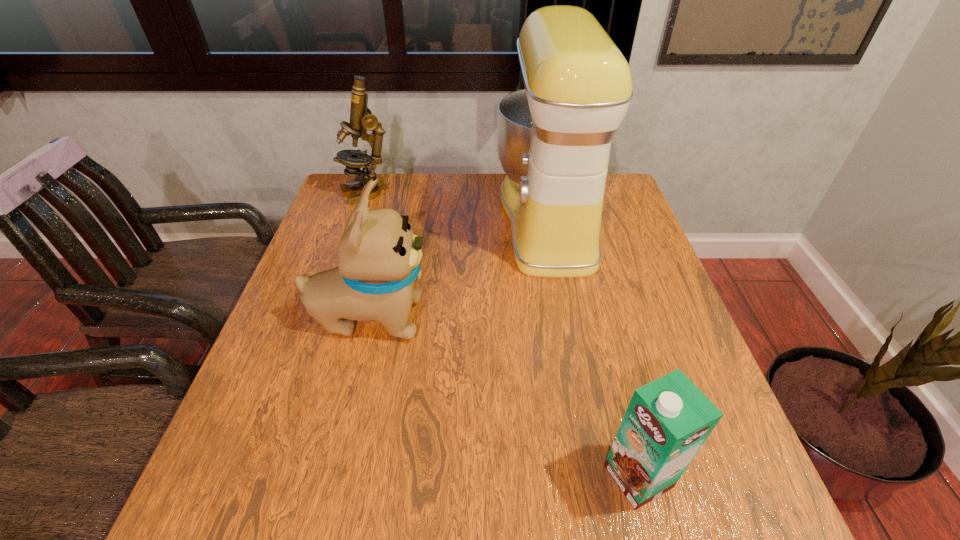
Identify the location of object that is at the near right corner. Image resolution: width=960 pixels, height=540 pixels. point(668,420).

The image size is (960, 540). Identify the location of vacant space at the far edge of the desktop. (419, 213).

At what (x,y) coordinates should I click in order to perform the action: click on free space at the near edge. Please return your answer as a coordinate pair (x, y). Image resolution: width=960 pixels, height=540 pixels. Looking at the image, I should click on (548, 488).

In the image, there is a desktop. Where is `vacant space at the left edge`? vacant space at the left edge is located at coordinates (316, 395).

In the image, there is a desktop. Find the location of `vacant space at the right edge`. vacant space at the right edge is located at coordinates (645, 270).

Image resolution: width=960 pixels, height=540 pixels. I want to click on free location at the near left corner, so click(235, 483).

The height and width of the screenshot is (540, 960). In order to click on vacant region between the tallest object and the nearest object in this screenshot , I will do `click(593, 348)`.

You are a GUI agent. You are given a task and a screenshot of the screen. Output one action in this format:
    pyautogui.click(x=<x>, y=<y>)
    Task: Click on the empty location between the microscope and the carton
    The height and width of the screenshot is (540, 960).
    Given the screenshot: What is the action you would take?
    pyautogui.click(x=502, y=335)

Where is `free spot between the second nearest object and the carton`? The image size is (960, 540). free spot between the second nearest object and the carton is located at coordinates (504, 397).

Where is `vacant area between the mixer and the nearest object`? vacant area between the mixer and the nearest object is located at coordinates (593, 348).